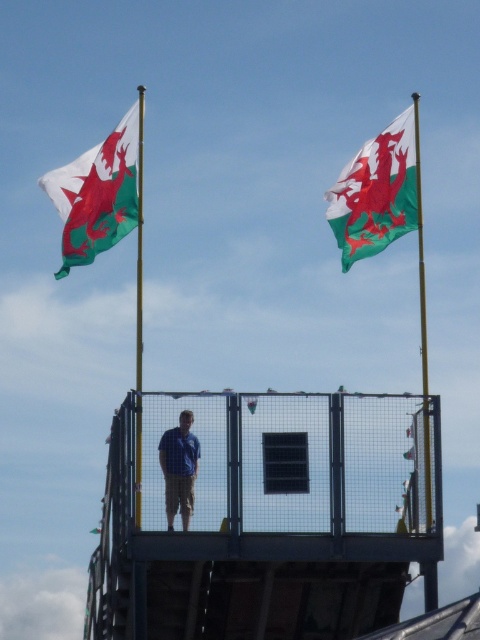
You are a photographer positioned behind the platform. You need to capture a clear shot of the blue shirt at center without the green and white fabric flag at upper right blocking it. Is this possible given their positions?

The green and white fabric flag at upper right is above the blue shirt at center, so it will block the view. To capture a clear shot of the blue shirt at center without the flag, you would need to adjust your angle or position to avoid the flag being in front of the shirt.